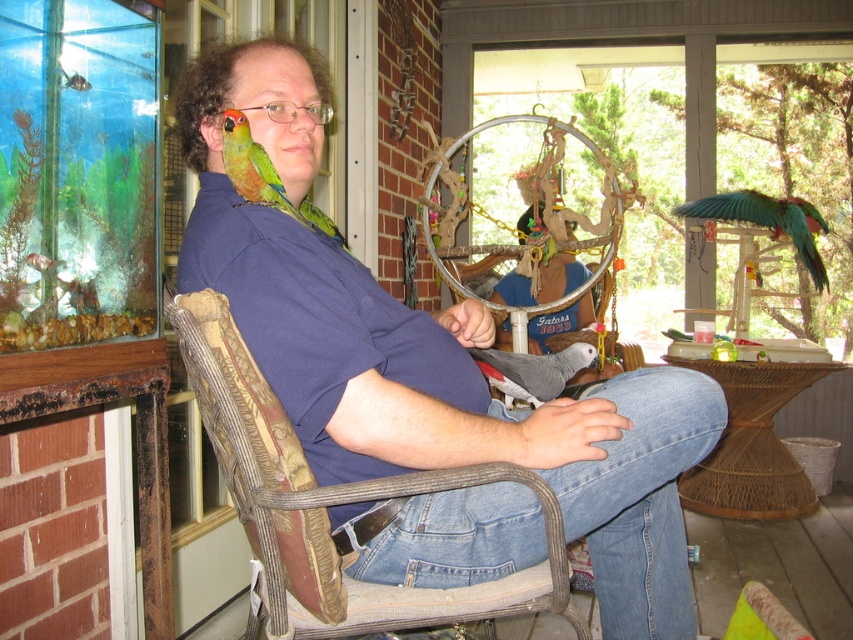
Is woven fabric chair at center further to the viewer compared to green matte parrot at left?

No.

Can you confirm if woven fabric chair at center is taller than green matte parrot at left?

Correct, woven fabric chair at center is much taller as green matte parrot at left.

Which is in front, point (281, 513) or point (228, 140)?

Point (281, 513) is more forward.

Locate an element on the screen. The image size is (853, 640). woven fabric chair at center is located at coordinates (329, 502).

Can you confirm if blue cotton shirt at center is taller than green matte parrot at left?

Correct, blue cotton shirt at center is much taller as green matte parrot at left.

Can you confirm if blue cotton shirt at center is shorter than green matte parrot at left?

In fact, blue cotton shirt at center may be taller than green matte parrot at left.

In order to click on blue cotton shirt at center in this screenshot , I will do `click(425, 355)`.

Who is taller, woven fabric chair at center or green metallic parrot at right?

woven fabric chair at center is taller.

Is point (288, 513) positioned behind point (811, 216)?

No, (288, 513) is in front of (811, 216).

Where is `woven fabric chair at center`? The width and height of the screenshot is (853, 640). woven fabric chair at center is located at coordinates (329, 502).